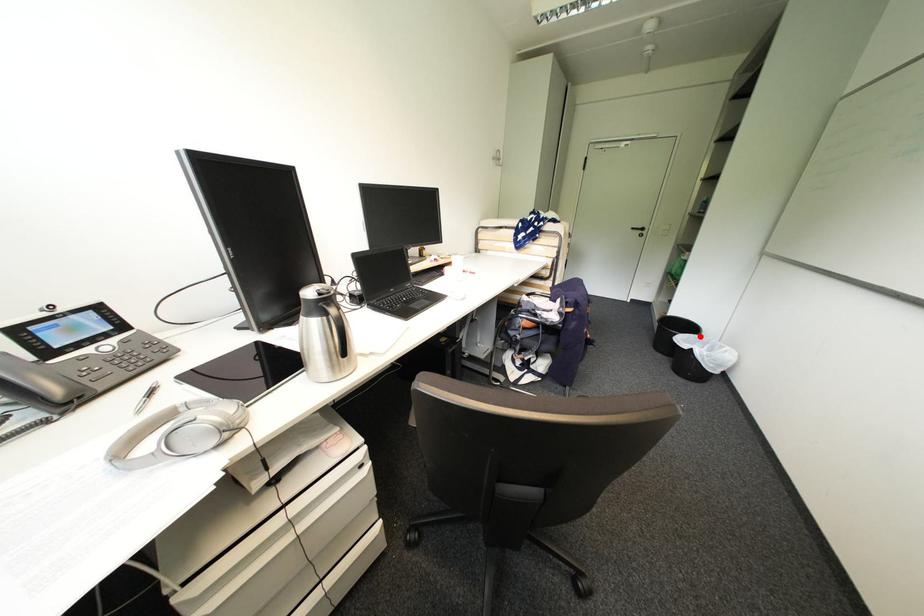
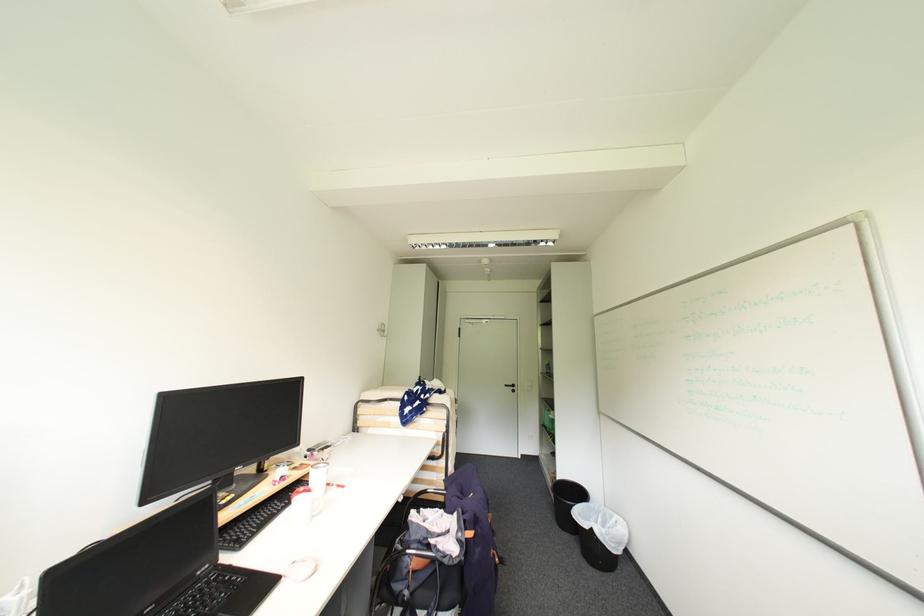
Locate, in the second image, the point that corresponds to the highlighted location in the first image.

(591, 505)